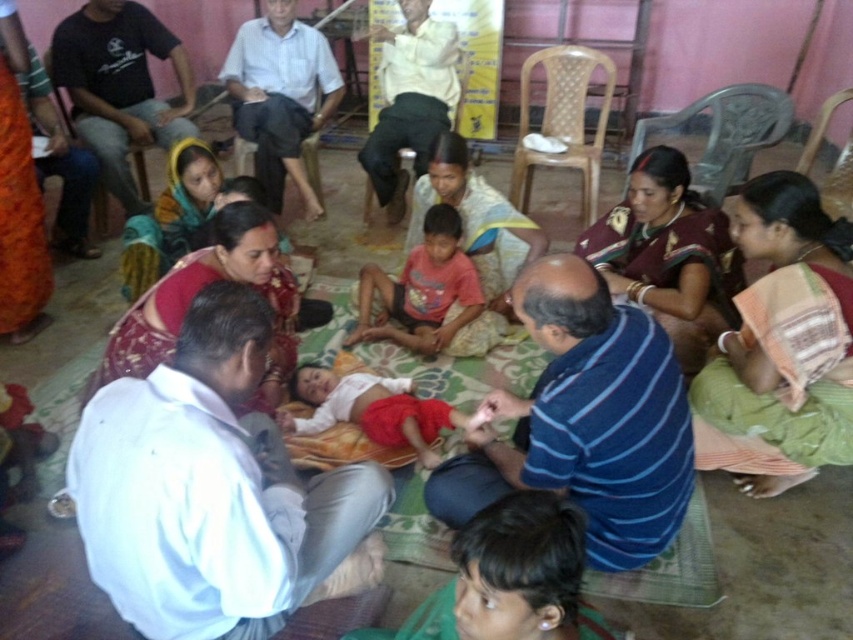
You are standing in the room and want to greet the person wearing the blue striped shirt at center. Which direction should you move from the black cotton shirt at upper left to reach them?

The blue striped shirt at center is to the right of the black cotton shirt at upper left, so you should move to the right from the black cotton shirt at upper left to reach them.

You are organizing a photo shoot and need to arrange the blue striped shirt at center and the black cotton shirt at upper left in a way that the smaller one is placed in front. Based on the scene description, which shirt should be positioned in front?

The blue striped shirt at center is smaller than the black cotton shirt at upper left, so the blue striped shirt at center should be positioned in front to ensure the smaller one is in front.